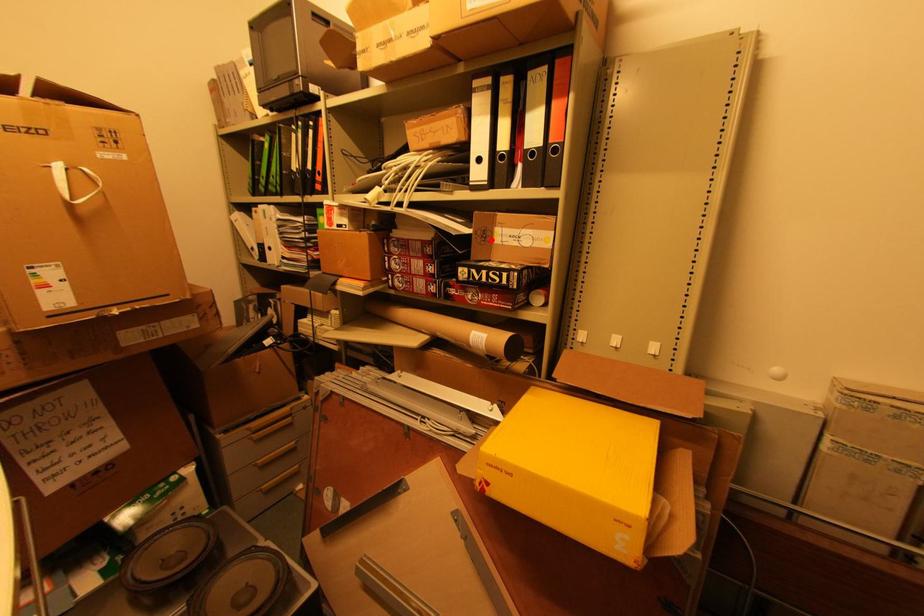
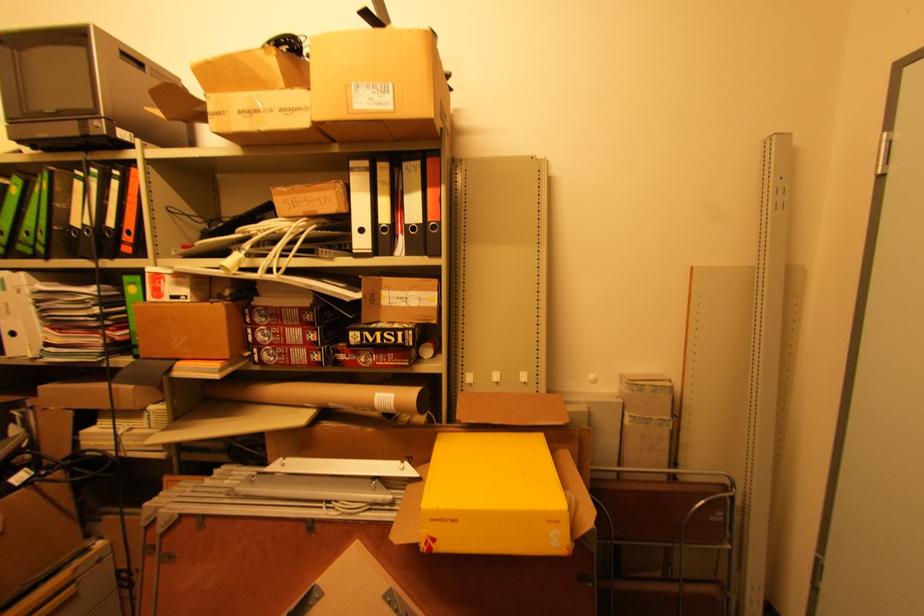
Locate, in the second image, the point that corresponds to the highlighted location in the first image.

(380, 302)